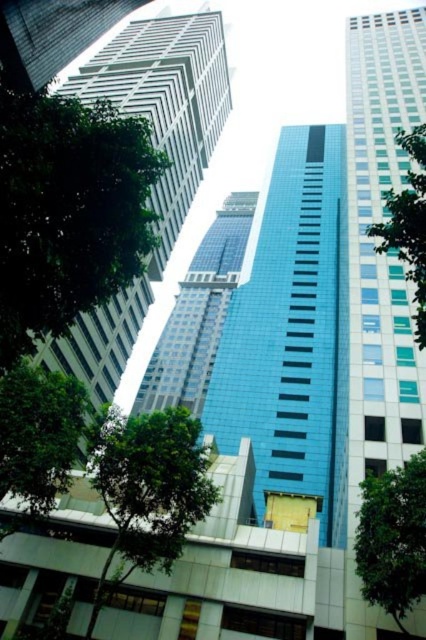
You are a city planner assessing the spacing between the green leafy tree at center and the green leafy tree at lower left. According to urban regulations, trees must be at least 3 meters apart for proper growth. Is the spacing between them compliant?

The distance between the green leafy tree at center and the green leafy tree at lower left is 3.17 meters, which exceeds the required 3 meters. Therefore, the spacing is compliant with urban regulations.

You are standing in the city looking at the skyscrapers. There are two points marked on the buildings. One is at point [22,250] and the other is at point [5,410]. Which point is closer to you?

Point [22,250] is closer to the camera than point [5,410].

You are standing in the city and see the point at coordinates (147, 490). What object is located at that point?

The point at coordinates (147, 490) is where the green leafy tree at center is located.